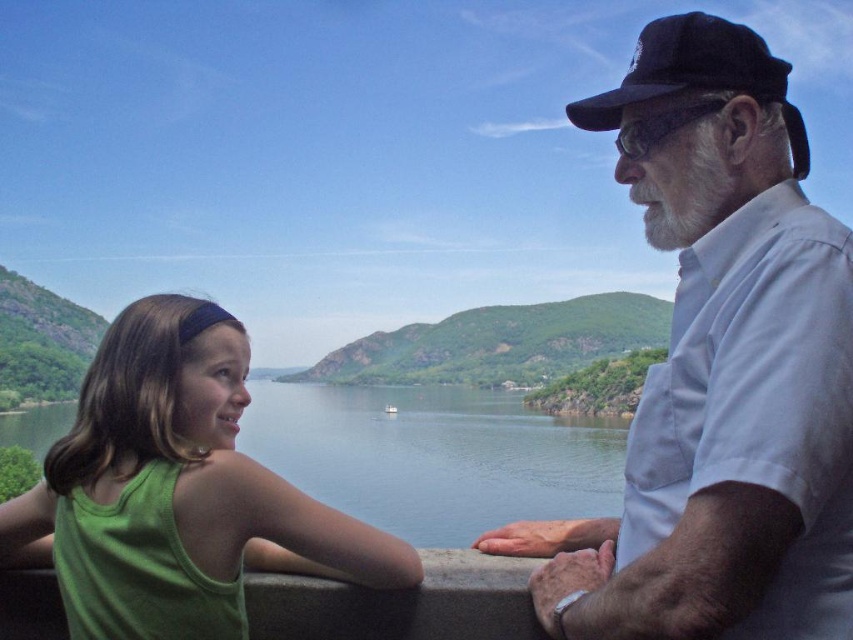
Question: Estimate the real-world distances between objects in this image. Which object is farther from the black felt baseball cap at upper right?

Choices:
 (A) green water at lower left
 (B) green fabric tank top at left

Answer: (A)

Question: Is white shirt at right below green water at lower left?

Choices:
 (A) no
 (B) yes

Answer: (A)

Question: Which point is closer to the camera?

Choices:
 (A) (79, 499)
 (B) (766, 54)

Answer: (A)

Question: Where is white shirt at right located in relation to black felt baseball cap at upper right in the image?

Choices:
 (A) left
 (B) right

Answer: (A)

Question: Where is green fabric tank top at left located in relation to green water at lower left in the image?

Choices:
 (A) left
 (B) right

Answer: (B)

Question: Which point is closer to the camera?

Choices:
 (A) (662, 20)
 (B) (289, 458)
 (C) (776, 268)

Answer: (C)